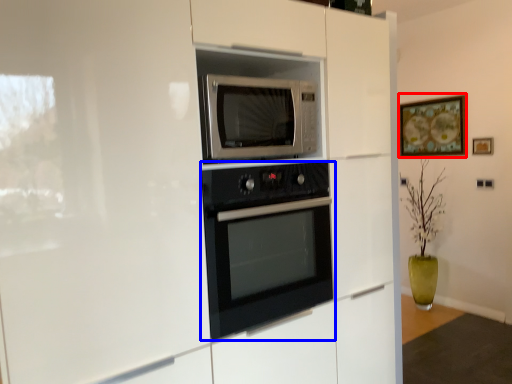
Question: Among these objects, which one is nearest to the camera, picture frame (highlighted by a red box) or oven (highlighted by a blue box)?

Choices:
 (A) picture frame
 (B) oven

Answer: (B)